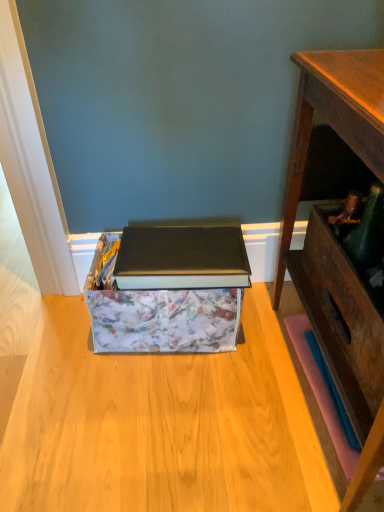
Where is `unoccupied area in front of floral-patterned cardboard box at center`? The width and height of the screenshot is (384, 512). unoccupied area in front of floral-patterned cardboard box at center is located at coordinates (164, 417).